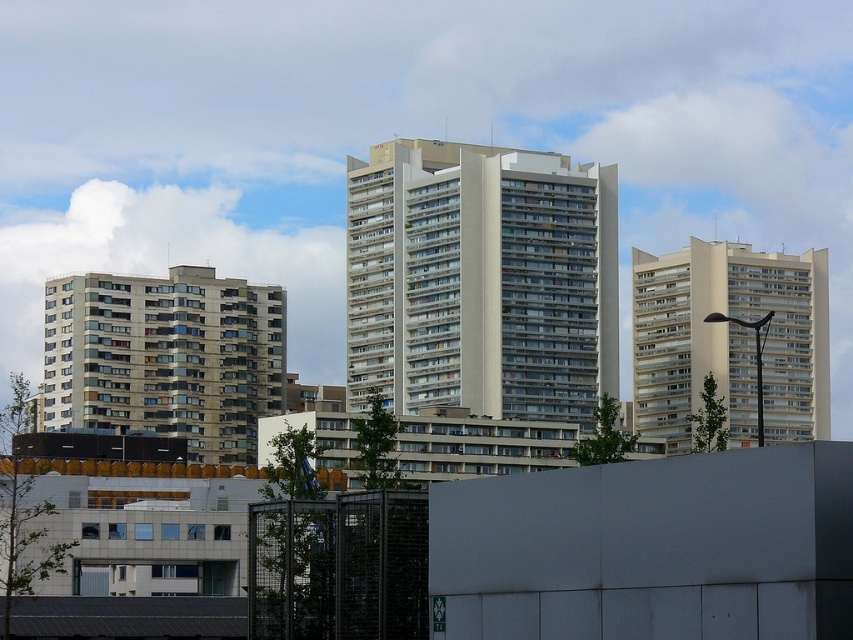
Question: Among these objects, which one is farthest from the camera?

Choices:
 (A) white smooth building at right
 (B) beige concrete building at left
 (C) white smooth building at center

Answer: (A)

Question: Among these objects, which one is farthest from the camera?

Choices:
 (A) white smooth building at right
 (B) white smooth building at center
 (C) beige concrete building at left

Answer: (A)

Question: Where is white smooth building at center located in relation to beige concrete building at left in the image?

Choices:
 (A) above
 (B) below

Answer: (A)

Question: Is beige concrete building at left wider than white smooth building at right?

Choices:
 (A) yes
 (B) no

Answer: (A)

Question: Is white smooth building at center wider than white smooth building at right?

Choices:
 (A) yes
 (B) no

Answer: (A)

Question: Among these objects, which one is nearest to the camera?

Choices:
 (A) white smooth building at right
 (B) beige concrete building at left

Answer: (B)